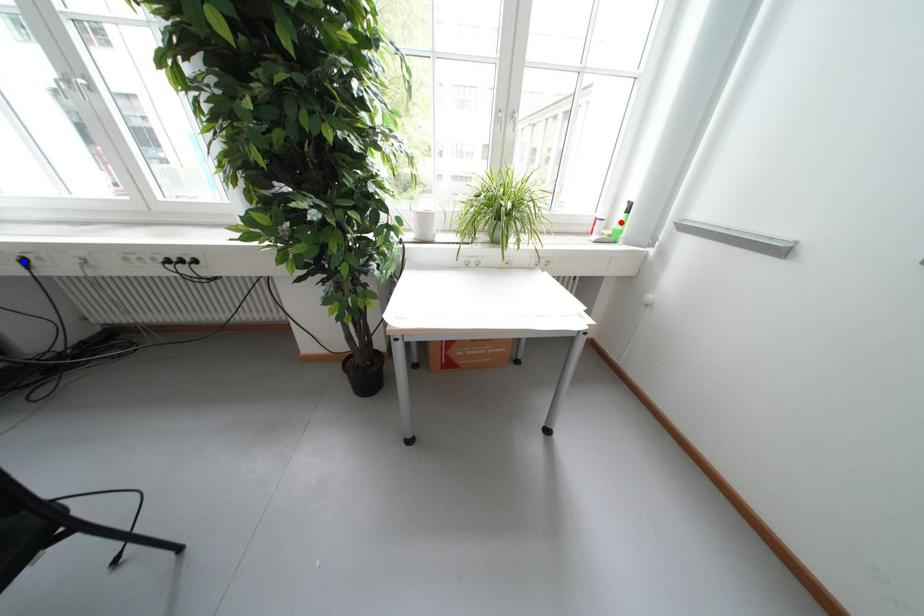
Question: Two points are marked on the image. Which point is closer to the camera?

Choices:
 (A) Blue point is closer.
 (B) Red point is closer.

Answer: (A)